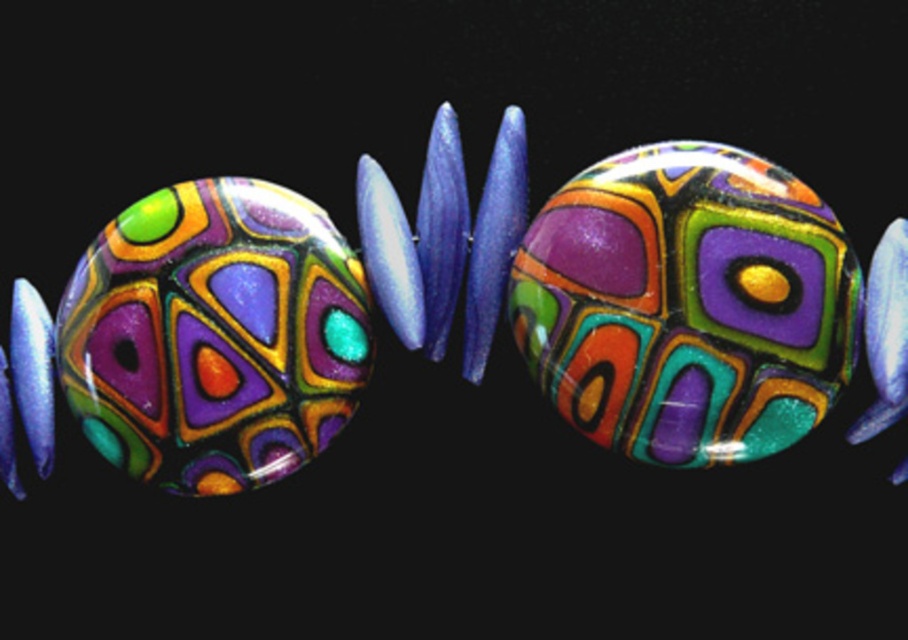
Does point (707, 380) come farther from viewer compared to point (312, 355)?

No, it is in front of (312, 355).

Who is more forward, (716, 193) or (96, 422)?

Point (716, 193)

This screenshot has height=640, width=908. I want to click on glossy glass bead at center, so click(x=687, y=305).